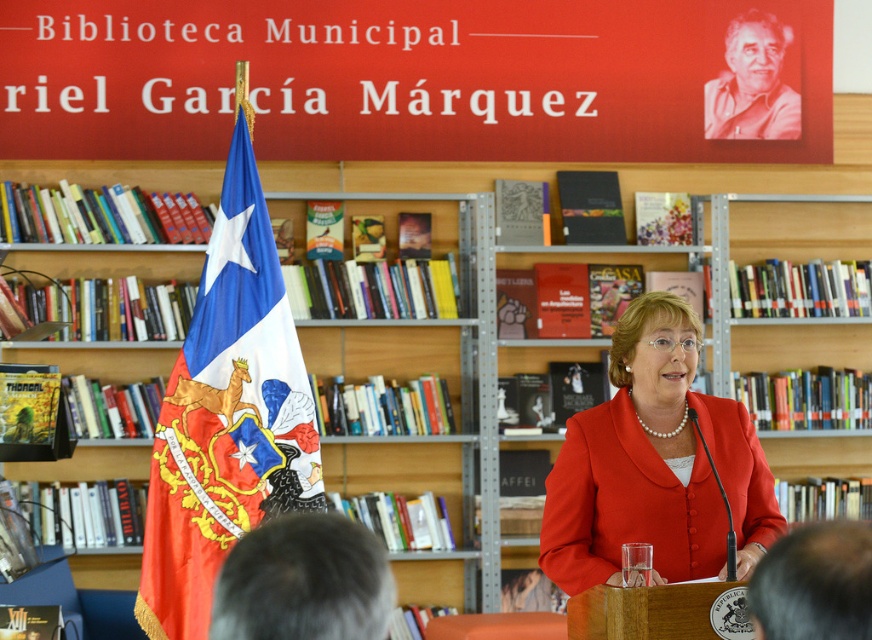
Does point (145, 259) come in front of point (614, 570)?

No, (145, 259) is behind (614, 570).

Between wooden bookshelf at center and matte red blazer at center, which one has more height?

With more height is matte red blazer at center.

At what (x,y) coordinates should I click in order to perform the action: click on wooden bookshelf at center. Please return your answer as a coordinate pair (x, y). Looking at the image, I should click on (773, 204).

I want to click on wooden bookshelf at center, so coord(773,204).

Is point (414, 182) farther from viewer compared to point (194, 632)?

That is True.

Between point (848, 348) and point (226, 214), which one is positioned behind?

The point (848, 348) is more distant.

Who is more distant from viewer, (277, 202) or (247, 262)?

Positioned behind is point (277, 202).

Where is `wooden bookshelf at center`? wooden bookshelf at center is located at coordinates (773, 204).

Locate an element on the screen. red fabric flag at left is located at coordinates (226, 413).

Is the position of red fabric flag at left less distant than that of matte red blazer at center?

That is False.

Locate an element on the screen. Image resolution: width=872 pixels, height=640 pixels. red fabric flag at left is located at coordinates (226, 413).